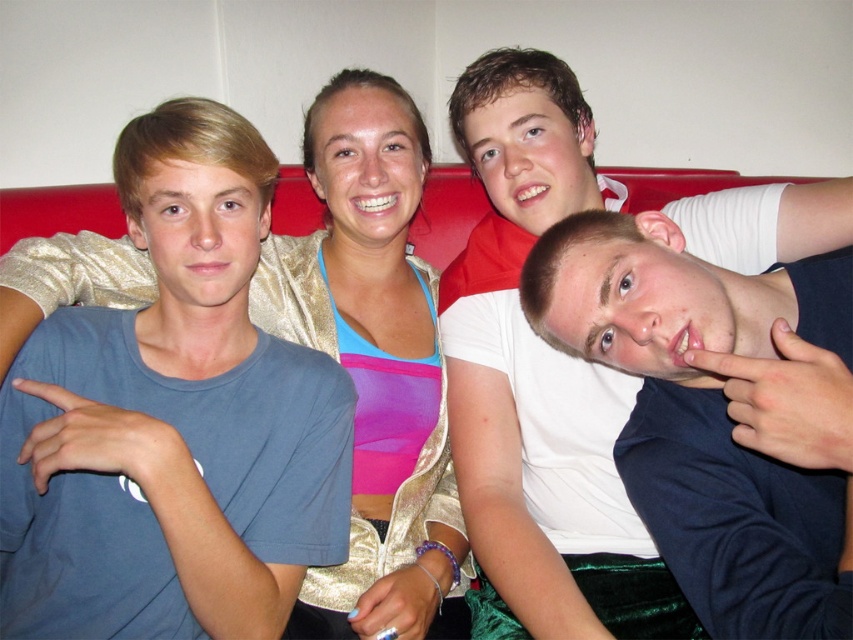
Does white cotton shirt at right have a greater height compared to gold shimmering jacket at center?

Incorrect, white cotton shirt at right's height is not larger of gold shimmering jacket at center's.

In the scene shown: Is white cotton shirt at right bigger than gold shimmering jacket at center?

No, white cotton shirt at right is not bigger than gold shimmering jacket at center.

What do you see at coordinates (538, 381) in the screenshot? I see `white cotton shirt at right` at bounding box center [538, 381].

Locate an element on the screen. The width and height of the screenshot is (853, 640). white cotton shirt at right is located at coordinates coord(538,381).